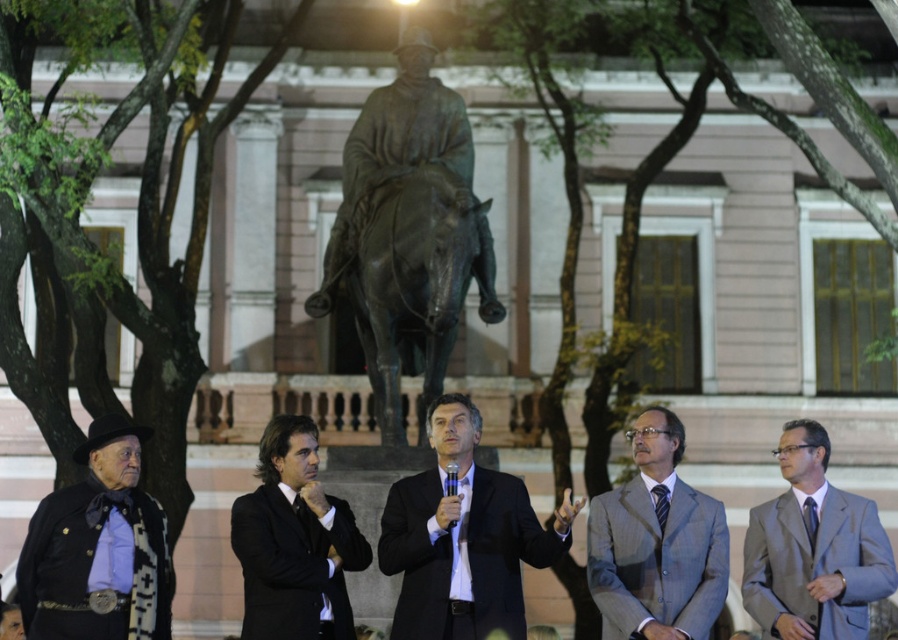
Between matte black suit at center and gray textured suit at center, which one is positioned higher?

matte black suit at center is above.

Is matte black suit at center bigger than gray textured suit at center?

No.

You are a GUI agent. You are given a task and a screenshot of the screen. Output one action in this format:
    pyautogui.click(x=<x>, y=<y>)
    Task: Click on the matte black suit at center
    This screenshot has height=640, width=898.
    Given the screenshot: What is the action you would take?
    pyautogui.click(x=463, y=538)

Identify the location of gray textured suit at center. (656, 545).

Where is `gray textured suit at center`? The width and height of the screenshot is (898, 640). gray textured suit at center is located at coordinates (656, 545).

Identify the location of gray textured suit at center. (656, 545).

Which is more to the right, bronze statue at center or black satin suit at center?

Positioned to the right is bronze statue at center.

Who is more forward, (x=392, y=355) or (x=287, y=483)?

Positioned in front is point (x=287, y=483).

Measure the distance between point [423,236] and camera.

They are 68.65 meters apart.

At what (x,y) coordinates should I click in order to perform the action: click on bronze statue at center. Please return your answer as a coordinate pair (x, y). Looking at the image, I should click on click(407, 234).